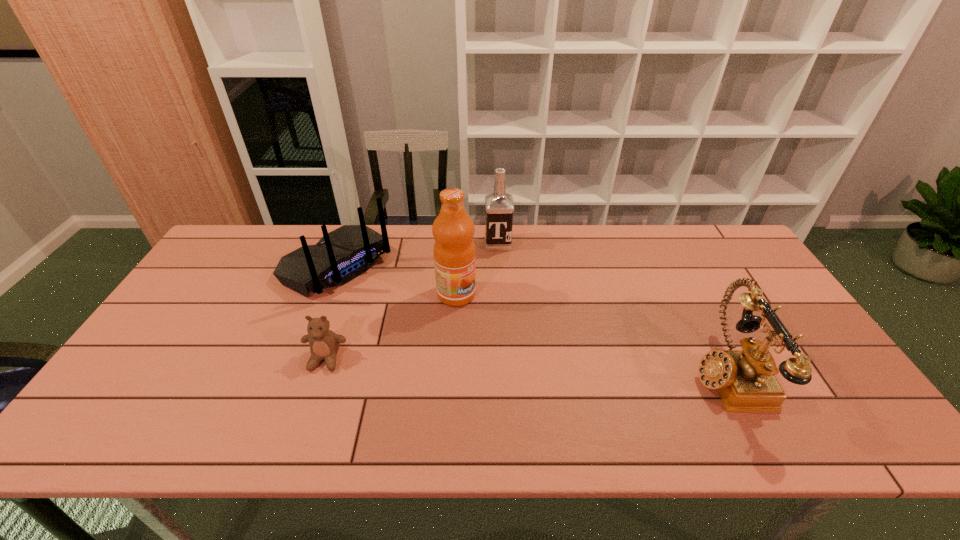
This screenshot has height=540, width=960. Identify the location of free point located 0.100m on the label side of the fruit juice. (495, 321).

The height and width of the screenshot is (540, 960). In order to click on vacant space located 0.140m on the label side of the fruit juice in this screenshot , I will do `click(507, 328)`.

The image size is (960, 540). Find the location of `vacant space situated on the label side of the fruit juice`. vacant space situated on the label side of the fruit juice is located at coordinates (526, 342).

Identify the location of vacant space situated 0.390m on the front label of the second object from right to left. The height and width of the screenshot is (540, 960). (508, 341).

Where is `free location located on the front label of the second object from right to left`? The width and height of the screenshot is (960, 540). free location located on the front label of the second object from right to left is located at coordinates (506, 319).

You are a GUI agent. You are given a task and a screenshot of the screen. Output one action in this format:
    pyautogui.click(x=<x>, y=<y>)
    Task: Click on the free space located on the front label of the second object from right to left
    The width and height of the screenshot is (960, 540).
    Given the screenshot: What is the action you would take?
    pyautogui.click(x=502, y=279)

Locate an element on the screen. The width and height of the screenshot is (960, 540). free spot located on the back of the router is located at coordinates (389, 302).

Locate an element on the screen. vacant space located 0.080m on the back of the router is located at coordinates (389, 302).

This screenshot has width=960, height=540. Identify the location of free location located 0.090m on the back of the router. (391, 303).

Find the location of `vodka at the far edge`. vodka at the far edge is located at coordinates (499, 205).